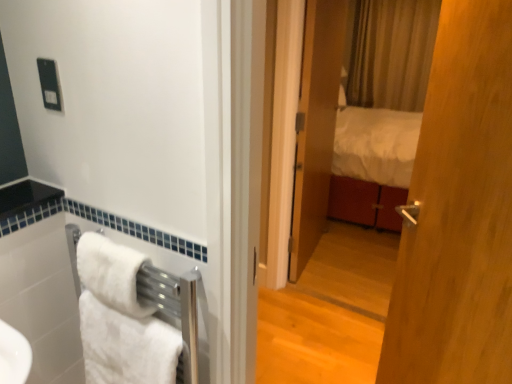
Question: Is white fluffy towel at lower left, which is counted as the 1th towel/napkin, starting from the bottom, to the left of matte wooden mirror at center from the viewer's perspective?

Choices:
 (A) yes
 (B) no

Answer: (A)

Question: Is white fluffy towel at lower left, the 2th towel/napkin viewed from the top, to the right of matte wooden mirror at center from the viewer's perspective?

Choices:
 (A) yes
 (B) no

Answer: (B)

Question: Is matte wooden mirror at center located within white fluffy towel at lower left, the 2th towel/napkin viewed from the top?

Choices:
 (A) yes
 (B) no

Answer: (B)

Question: Is white fluffy towel at lower left, the 2th towel/napkin viewed from the top, wider than matte wooden mirror at center?

Choices:
 (A) yes
 (B) no

Answer: (A)

Question: Is white fluffy towel at lower left, which is counted as the 1th towel/napkin, starting from the bottom, closer to camera compared to matte wooden mirror at center?

Choices:
 (A) no
 (B) yes

Answer: (B)

Question: From a real-world perspective, is white fluffy towel at lower left, the 2th towel/napkin viewed from the top, positioned over matte wooden mirror at center based on gravity?

Choices:
 (A) yes
 (B) no

Answer: (B)

Question: From a real-world perspective, is black plastic outlet at upper left on white soft towel at lower left, which is the 2th towel/napkin in bottom-to-top order?

Choices:
 (A) yes
 (B) no

Answer: (A)

Question: Could you tell me if black plastic outlet at upper left is turned towards white soft towel at lower left, which is the 1th towel/napkin in top-to-bottom order?

Choices:
 (A) yes
 (B) no

Answer: (B)

Question: Is black plastic outlet at upper left next to white soft towel at lower left, which is the 2th towel/napkin in bottom-to-top order, and touching it?

Choices:
 (A) yes
 (B) no

Answer: (B)

Question: Can you confirm if black plastic outlet at upper left is thinner than white soft towel at lower left, which is the 1th towel/napkin in top-to-bottom order?

Choices:
 (A) yes
 (B) no

Answer: (A)

Question: Would you say black plastic outlet at upper left is outside white soft towel at lower left, which is the 1th towel/napkin in top-to-bottom order?

Choices:
 (A) no
 (B) yes

Answer: (B)

Question: Is black plastic outlet at upper left positioned in front of white soft towel at lower left, which is the 1th towel/napkin in top-to-bottom order?

Choices:
 (A) yes
 (B) no

Answer: (B)

Question: Is white soft towel at lower left, which is the 2th towel/napkin in bottom-to-top order, positioned in front of black plastic outlet at upper left?

Choices:
 (A) yes
 (B) no

Answer: (A)